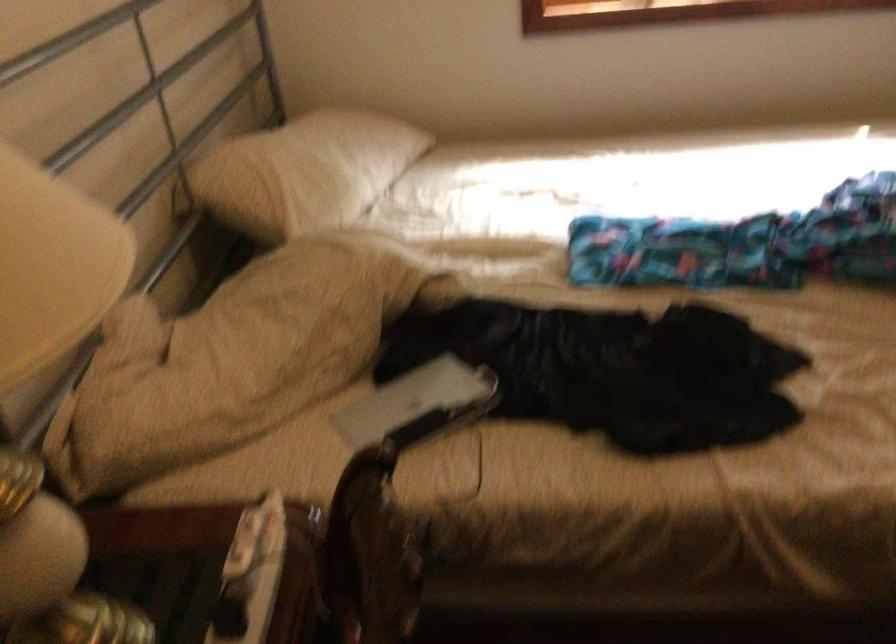
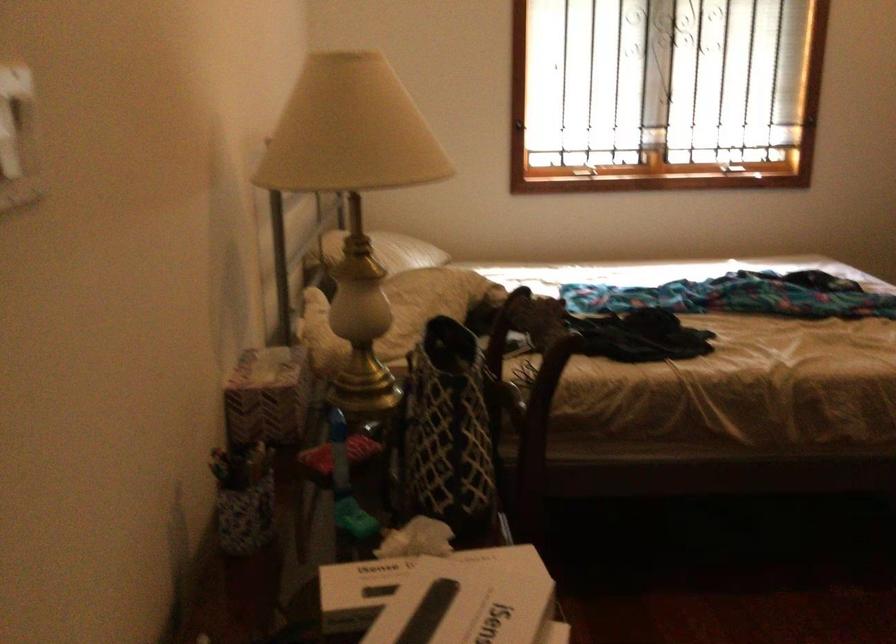
Question: I am providing you with two images of the same scene from different viewpoints. Which of the following objects are not visible in image2?

Choices:
 (A) window latch
 (B) white pillow
 (C) silver electronic device
 (D) green sofa armrest

Answer: (C)